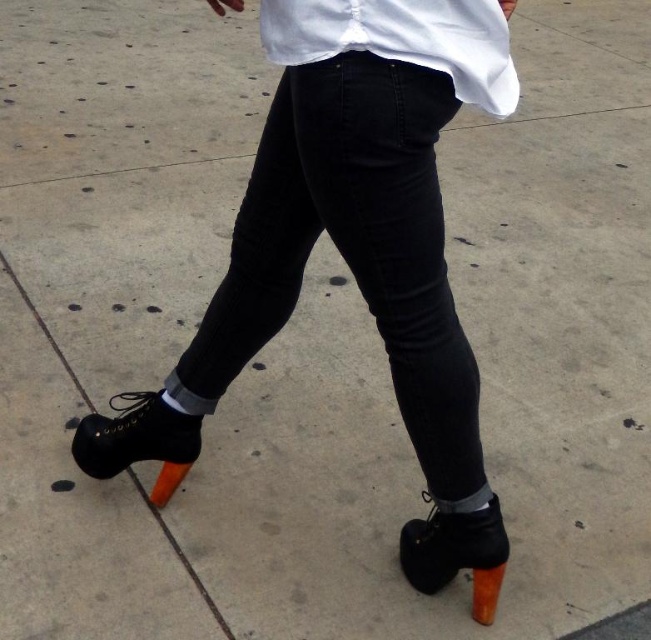
Question: Which point is closer to the camera taking this photo?

Choices:
 (A) (477, 596)
 (B) (83, 419)
 (C) (493, 561)

Answer: (C)

Question: Which of the following is the farthest from the observer?

Choices:
 (A) black denim jeans at center
 (B) black leather shoe at lower left
 (C) orange matte heel at lower left

Answer: (C)

Question: Observing the image, what is the correct spatial positioning of black denim jeans at center in reference to black leather shoe at lower left?

Choices:
 (A) above
 (B) below

Answer: (A)

Question: Does black leather shoe at lower left appear over orange matte heel at lower left?

Choices:
 (A) no
 (B) yes

Answer: (B)

Question: Which is farther from the black denim jeans at center?

Choices:
 (A) orange matte high-heeled shoe at lower center
 (B) white matte shirt at upper center
 (C) orange matte heel at lower left

Answer: (C)

Question: From the image, what is the correct spatial relationship of black leather shoe at lower left in relation to orange matte high-heeled shoe at lower center?

Choices:
 (A) above
 (B) below

Answer: (A)